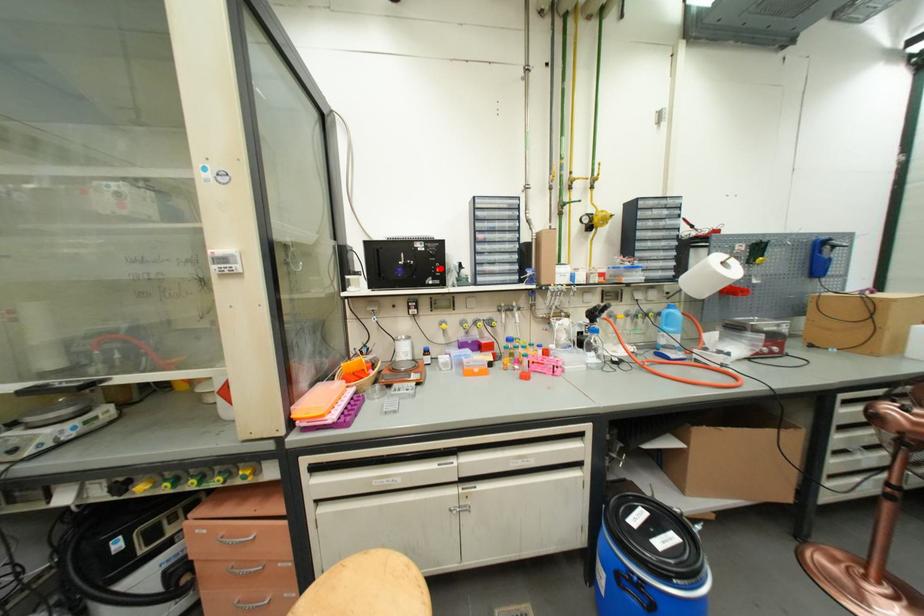
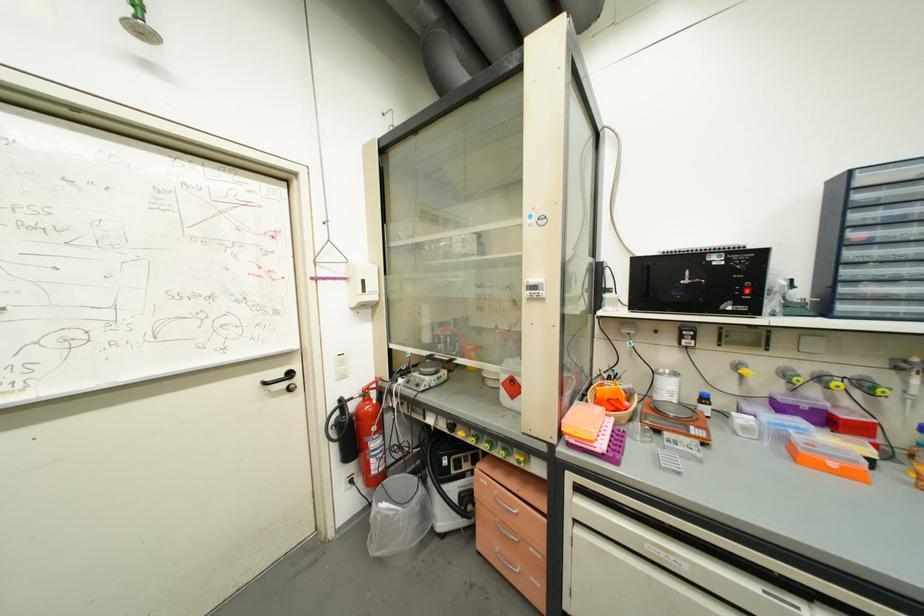
Locate, in the second image, the point that corresponds to the highlighted location in the first image.

(748, 288)